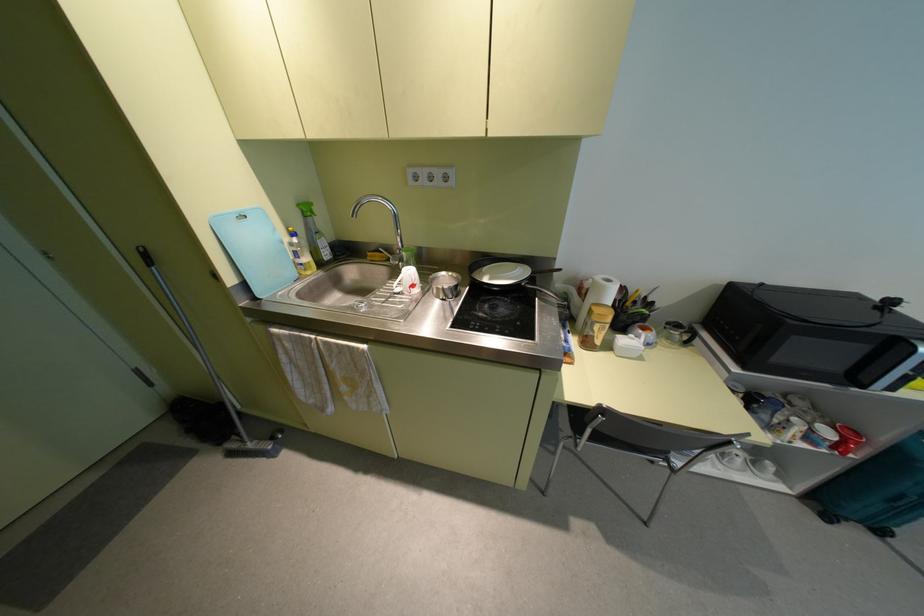
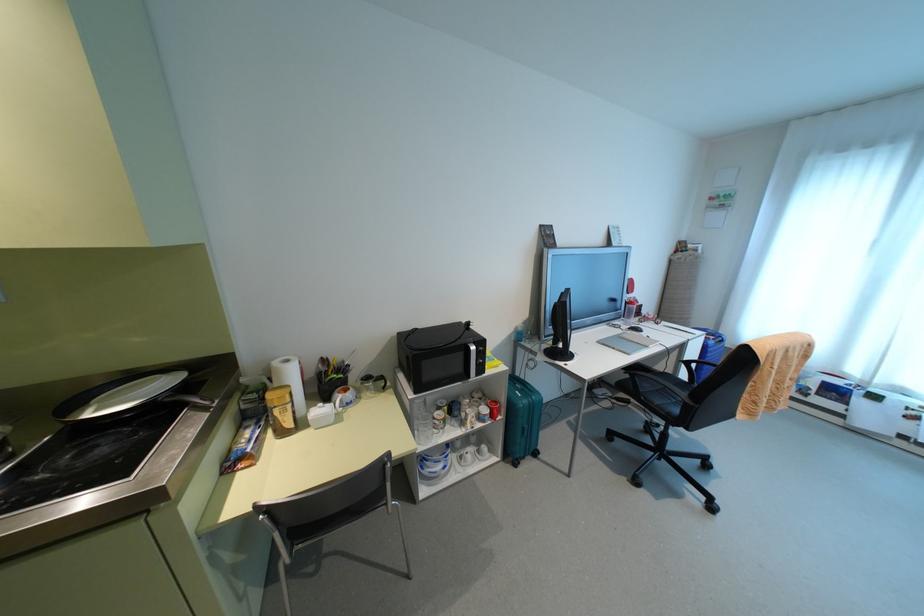
The point at (x=598, y=341) is marked in the first image. Where is the corresponding point in the second image?

(288, 424)